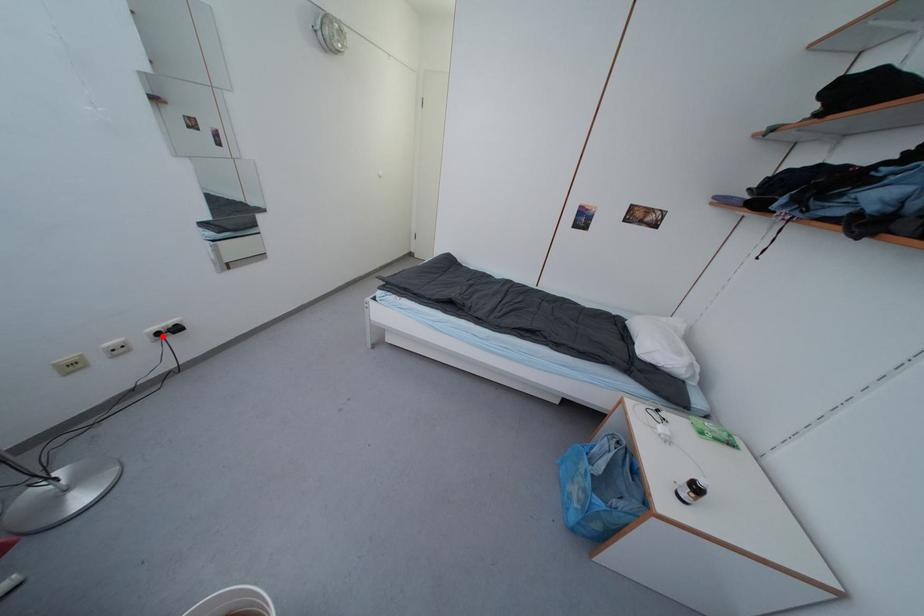
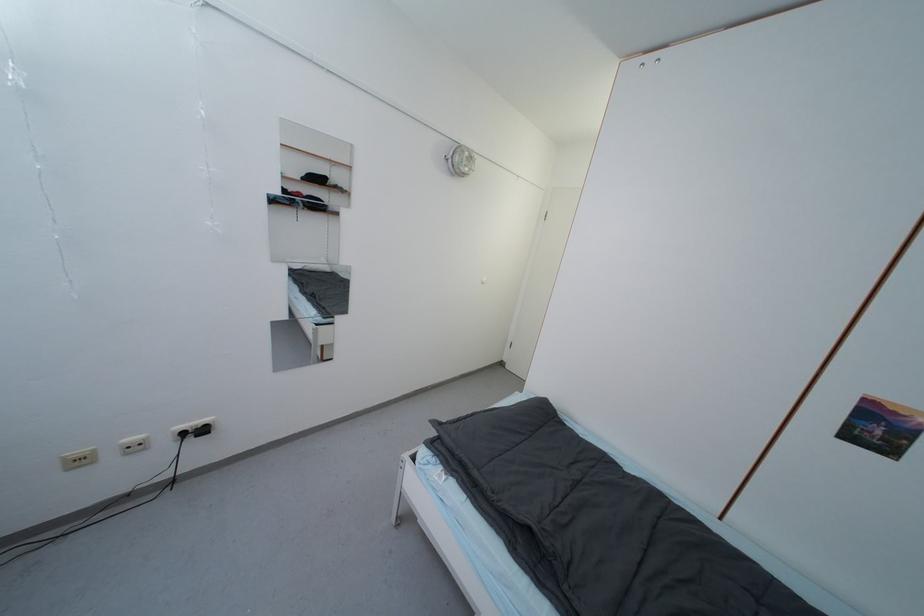
Find the pixel in the second image that matches the highlighted location in the first image.

(187, 436)